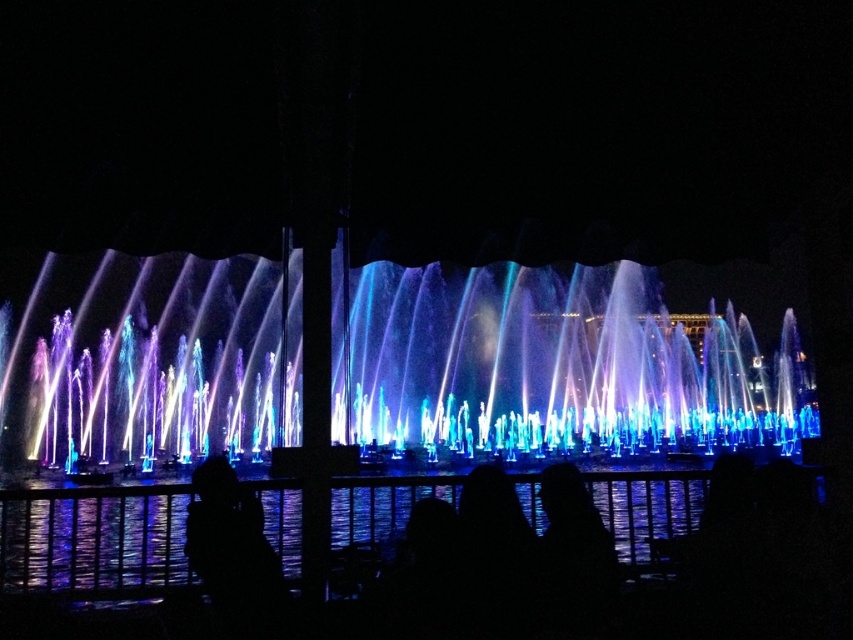
Based on the photo, who is more distant from viewer, (621, 291) or (370, 529)?

The point (621, 291) is more distant.

Which is above, iridescent water at center or blue reflective water at center?

Positioned higher is iridescent water at center.

Who is more forward, (126,360) or (379,508)?

Positioned in front is point (379,508).

Locate an element on the screen. iridescent water at center is located at coordinates (554, 365).

Measure the distance between iridescent water at center and camera.

iridescent water at center is 34.29 meters away from camera.

Locate an element on the screen. iridescent water at center is located at coordinates (554, 365).

Where is `iridescent water at center`? Image resolution: width=853 pixels, height=640 pixels. iridescent water at center is located at coordinates (554, 365).

The width and height of the screenshot is (853, 640). Identify the location of iridescent water at center. (554, 365).

Between blue reflective water at center and black matte person at lower left, which one has less height?

black matte person at lower left is shorter.

What are the coordinates of `blue reflective water at center` in the screenshot? It's located at (94, 540).

Between point (677, 486) and point (274, 554), which one is positioned in front?

Positioned in front is point (274, 554).

Locate an element on the screen. blue reflective water at center is located at coordinates (94, 540).